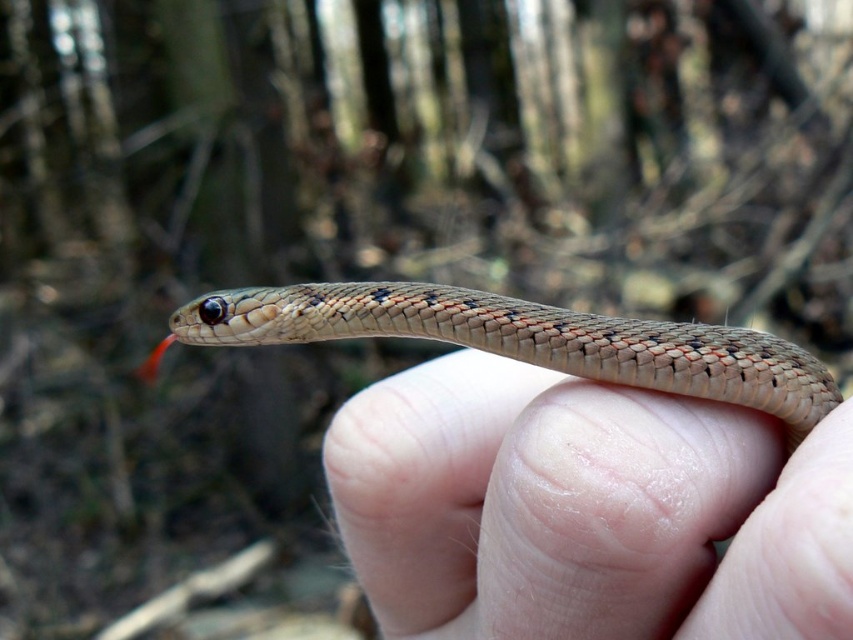
Can you confirm if smooth skin at center is positioned below speckled scales snake at center?

Correct, smooth skin at center is located below speckled scales snake at center.

Is smooth skin at center thinner than speckled scales snake at center?

Indeed, smooth skin at center has a lesser width compared to speckled scales snake at center.

Does point (692, 621) lie behind point (421, 301)?

No, it is not.

This screenshot has width=853, height=640. Identify the location of smooth skin at center. (585, 509).